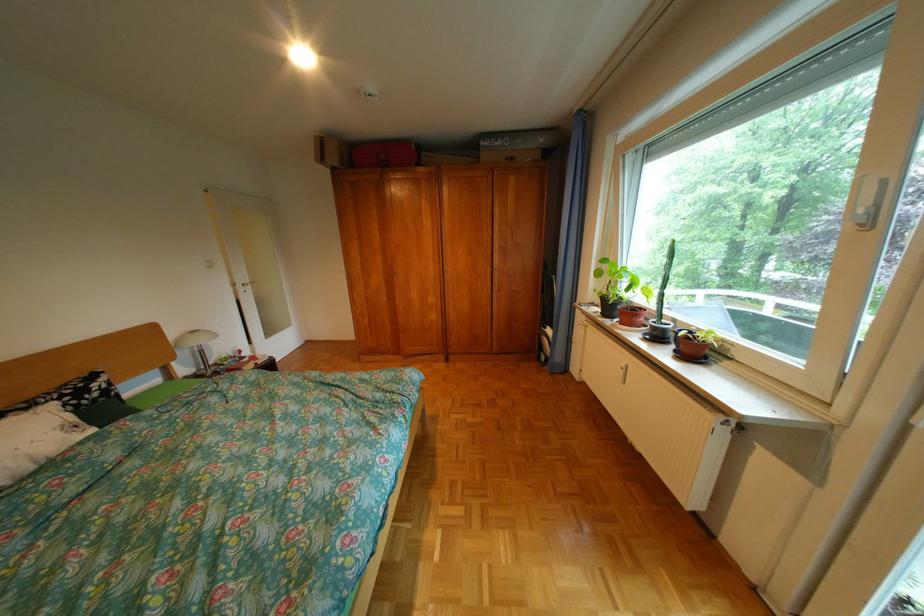
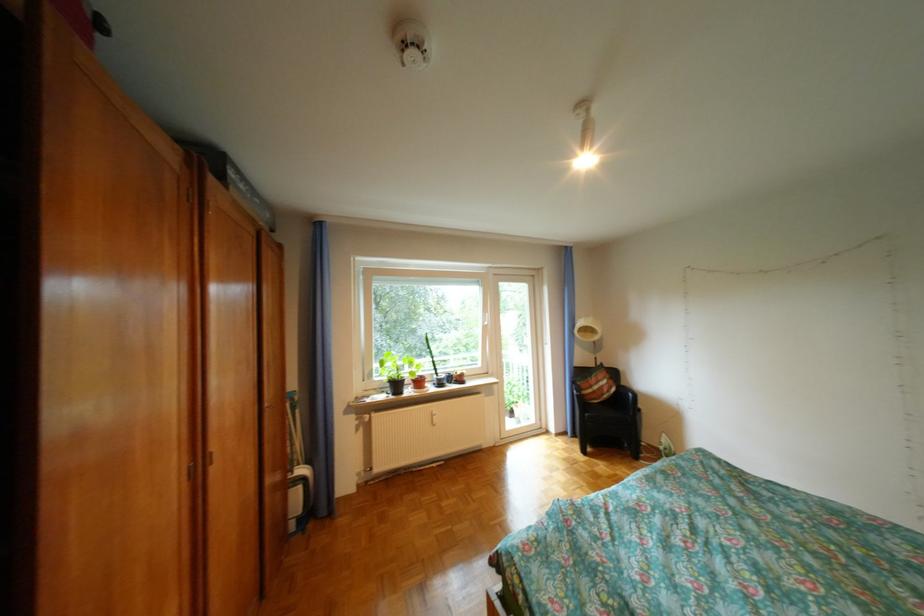
Question: I am providing you with two images of the same scene from different viewpoints. Which of the following objects are not visible in image2?

Choices:
 (A) small potted plant
 (B) brown flower pot
 (C) black chair armrest
 (D) floor panel cover

Answer: (B)